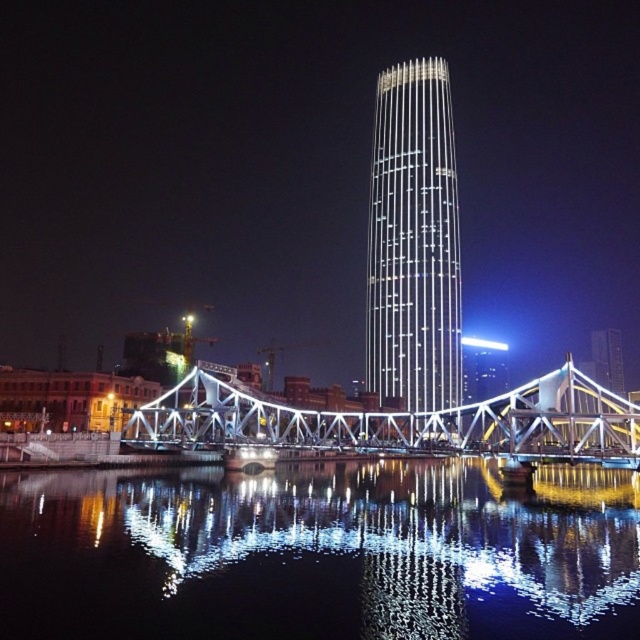
You are standing on the sidewalk near the black reflective water at center and the metallic bridge at center. If you look directly above you, which object would you see?

You would see the metallic bridge at center directly above you because the black reflective water at center is located below it.

What are the coordinates of the shiny glass tower at center?

The shiny glass tower at center is located at point (413, 241).

You are an architect reviewing the city layout. You need to determine which structure, the shiny glass tower at center or the metallic bridge at center, has a greater height. Based on the scene, which one is taller?

The shiny glass tower at center is taller than the metallic bridge at center according to the description.